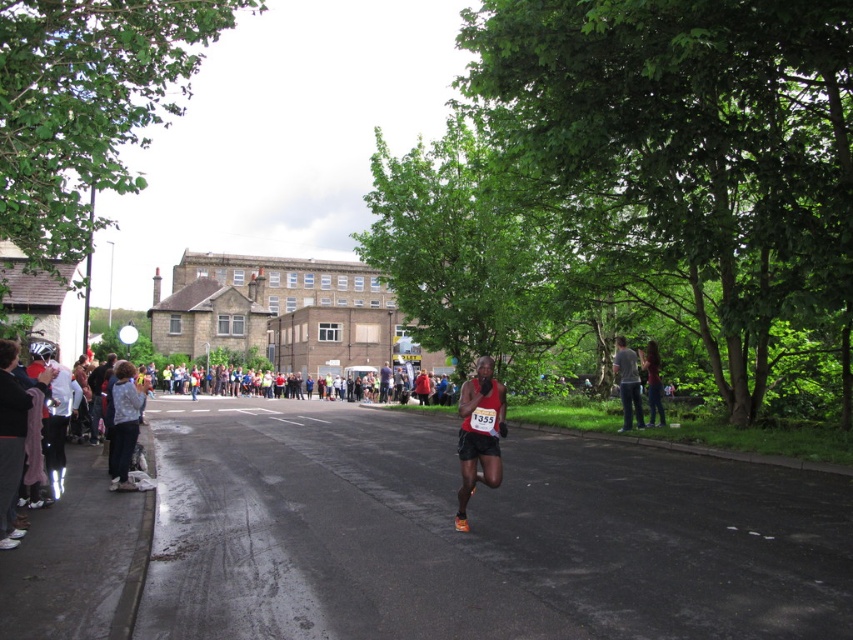
Which is more to the right, black asphalt road at center or red fabric runner at center?

red fabric runner at center is more to the right.

Can you confirm if black asphalt road at center is shorter than red fabric runner at center?

No.

This screenshot has width=853, height=640. In order to click on black asphalt road at center in this screenshot , I will do `click(474, 536)`.

Find the location of a particular element. black asphalt road at center is located at coordinates (474, 536).

Is point (126, 400) farther from viewer compared to point (637, 372)?

That is False.

Which is behind, point (126, 385) or point (624, 406)?

Point (624, 406)

What do you see at coordinates (125, 424) in the screenshot? I see `denim jacket at left` at bounding box center [125, 424].

At what (x,y) coordinates should I click in order to perform the action: click on denim jacket at left. Please return your answer as a coordinate pair (x, y). Looking at the image, I should click on (125, 424).

Based on the photo, does denim jacket at left have a larger size compared to green leafy tree at right?

Correct, denim jacket at left is larger in size than green leafy tree at right.

Between point (120, 413) and point (657, 358), which one is positioned behind?

Point (657, 358)

Does point (112, 422) come behind point (660, 422)?

No, it is not.

Identify the location of denim jacket at left. Image resolution: width=853 pixels, height=640 pixels. point(125,424).